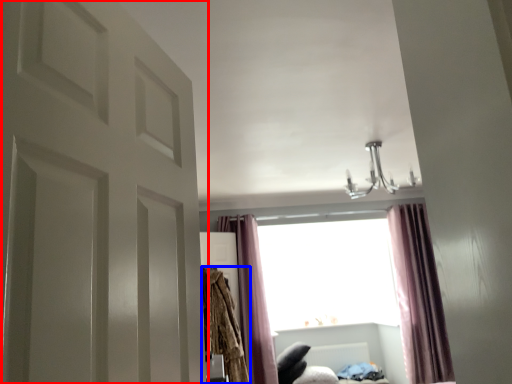
Question: Which object is closer to the camera taking this photo, door (highlighted by a red box) or robe (highlighted by a blue box)?

Choices:
 (A) door
 (B) robe

Answer: (A)